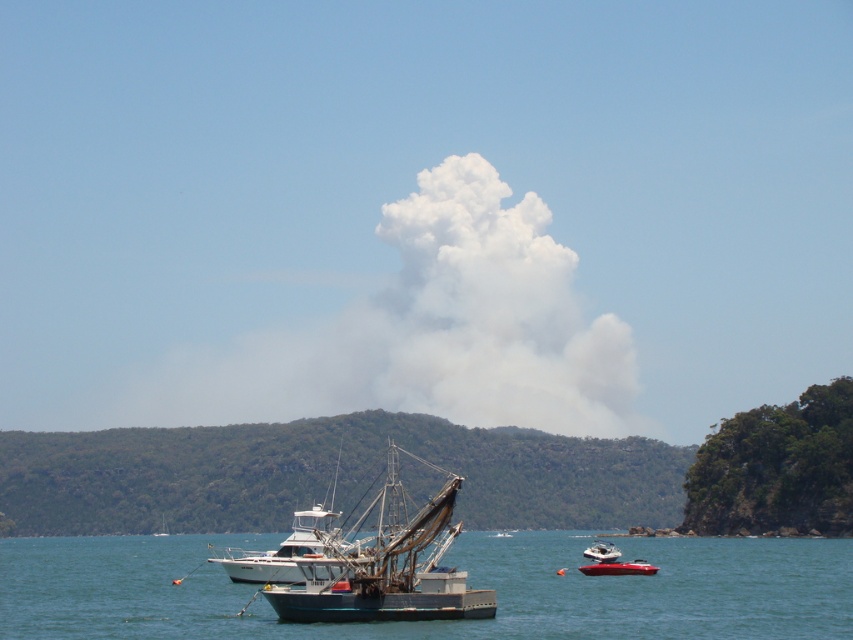
Does white smoke cloud at center come behind metallic silver boat at lower right?

Yes, white smoke cloud at center is further from the viewer.

Is white smoke cloud at center to the right of metallic silver boat at lower right from the viewer's perspective?

Incorrect, white smoke cloud at center is not on the right side of metallic silver boat at lower right.

Identify the location of white smoke cloud at center. Image resolution: width=853 pixels, height=640 pixels. (434, 330).

Identify the location of white smoke cloud at center. This screenshot has width=853, height=640. (434, 330).

Between white smoke cloud at center and white plastic boat at center, which one is positioned higher?

white smoke cloud at center is above.

Does white smoke cloud at center have a greater height compared to white plastic boat at center?

Yes, white smoke cloud at center is taller than white plastic boat at center.

At what (x,y) coordinates should I click in order to perform the action: click on white smoke cloud at center. Please return your answer as a coordinate pair (x, y). Looking at the image, I should click on (x=434, y=330).

Is white smoke cloud at center above blue metallic fishing boat at center?

Yes.

Is point (346, 387) closer to camera compared to point (457, 490)?

No, (346, 387) is behind (457, 490).

The height and width of the screenshot is (640, 853). In order to click on white smoke cloud at center in this screenshot , I will do `click(434, 330)`.

Find the location of a particular element. white smoke cloud at center is located at coordinates (434, 330).